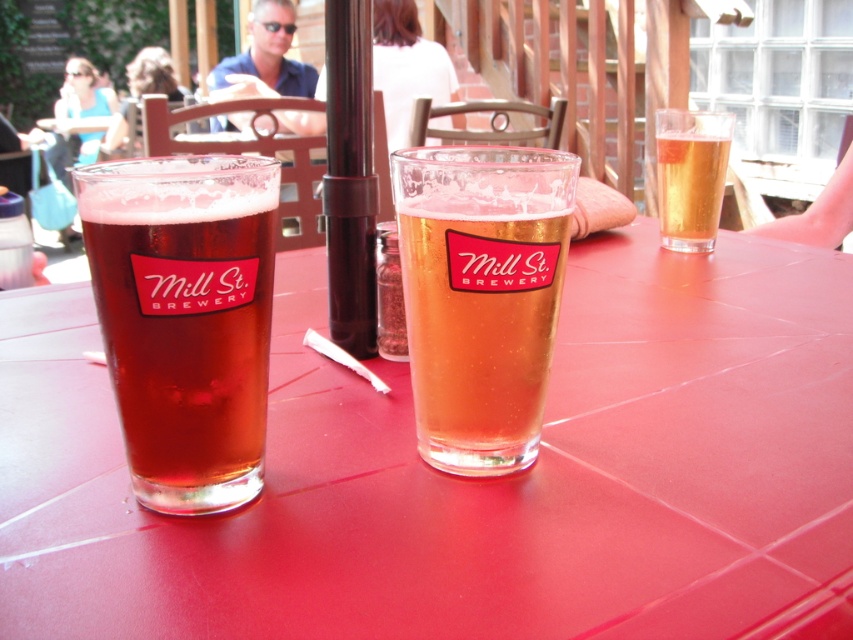
Question: Where is translucent glass table at center located in relation to translucent glass at upper right in the image?

Choices:
 (A) below
 (B) above

Answer: (A)

Question: Which point appears farthest from the camera in this image?

Choices:
 (A) (45, 436)
 (B) (676, 236)
 (C) (196, 308)

Answer: (B)

Question: Which of the following is the farthest from the observer?

Choices:
 (A) translucent amber glass at center
 (B) translucent glass at upper right

Answer: (B)

Question: Which of the following is the closest to the observer?

Choices:
 (A) translucent amber glass at center
 (B) translucent glass at center

Answer: (A)

Question: Is translucent amber glass at center thinner than translucent glass at upper right?

Choices:
 (A) no
 (B) yes

Answer: (B)

Question: Is translucent glass table at center positioned behind translucent amber glass at center?

Choices:
 (A) yes
 (B) no

Answer: (B)